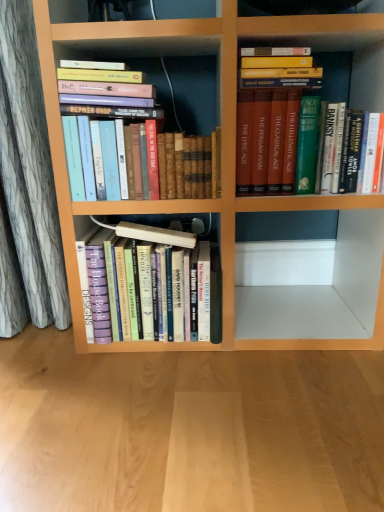
Question: Considering the relative sizes of hardcover books at center, which ranks as the 2th book in right-to-left order, and wooden floor at lower center in the image provided, is hardcover books at center, which ranks as the 2th book in right-to-left order, taller than wooden floor at lower center?

Choices:
 (A) no
 (B) yes

Answer: (B)

Question: Is wooden floor at lower center at the back of hardcover books at center, which ranks as the 2th book in right-to-left order?

Choices:
 (A) no
 (B) yes

Answer: (A)

Question: Is hardcover books at center, which ranks as the 2th book in right-to-left order, directly adjacent to wooden floor at lower center?

Choices:
 (A) no
 (B) yes

Answer: (A)

Question: From the image's perspective, is hardcover books at center, arranged as the second book when viewed from the left, on wooden floor at lower center?

Choices:
 (A) yes
 (B) no

Answer: (A)

Question: Is hardcover books at center, arranged as the second book when viewed from the left, shorter than wooden floor at lower center?

Choices:
 (A) yes
 (B) no

Answer: (B)

Question: From a real-world perspective, is hardcover books at center, which ranks as the 2th book in right-to-left order, over wooden floor at lower center?

Choices:
 (A) yes
 (B) no

Answer: (A)

Question: Does hardcover books at upper left, placed as the third book when sorted from right to left, come in front of hardcover books at center, which ranks as the 2th book in right-to-left order?

Choices:
 (A) yes
 (B) no

Answer: (A)

Question: Is hardcover books at upper left, placed as the third book when sorted from right to left, placed right next to hardcover books at center, which ranks as the 2th book in right-to-left order?

Choices:
 (A) no
 (B) yes

Answer: (A)

Question: From the image's perspective, is hardcover books at upper left, the 1th book when ordered from left to right, located above hardcover books at center, which ranks as the 2th book in right-to-left order?

Choices:
 (A) no
 (B) yes

Answer: (B)

Question: Is hardcover books at center, which ranks as the 2th book in right-to-left order, inside hardcover books at upper left, placed as the third book when sorted from right to left?

Choices:
 (A) yes
 (B) no

Answer: (B)

Question: Is hardcover books at center, which ranks as the 2th book in right-to-left order, at the back of hardcover books at upper left, placed as the third book when sorted from right to left?

Choices:
 (A) no
 (B) yes

Answer: (A)

Question: Is hardcover books at upper left, placed as the third book when sorted from right to left, at the right side of hardcover books at center, which ranks as the 2th book in right-to-left order?

Choices:
 (A) yes
 (B) no

Answer: (B)

Question: Is wooden floor at lower center bigger than green hardcover book at upper right, marked as the third book in a left-to-right arrangement?

Choices:
 (A) yes
 (B) no

Answer: (A)